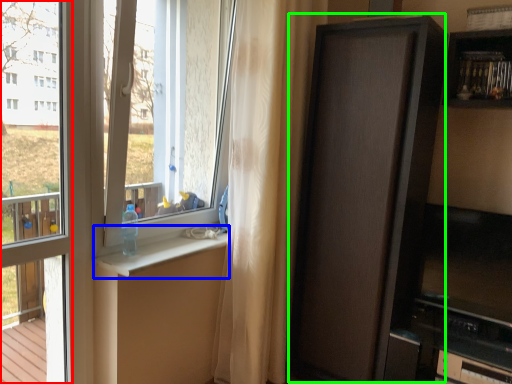
Question: Which object is positioned closest to window frame (highlighted by a red box)? Select from window sill (highlighted by a blue box) and screen door (highlighted by a green box).

Choices:
 (A) window sill
 (B) screen door

Answer: (A)